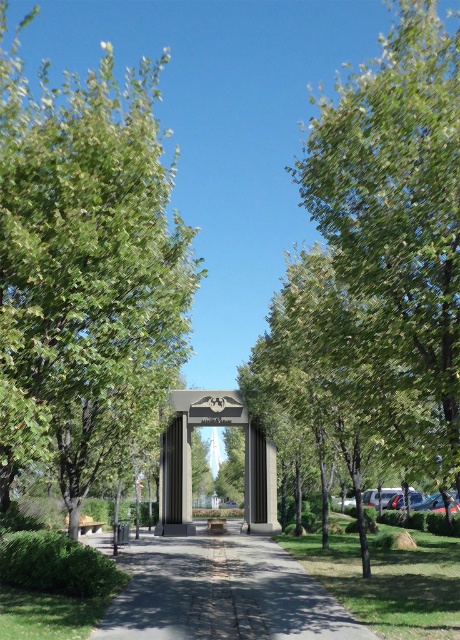
You are a gardener planning to place a 3m wide decorative fountain between the green leafy tree at left and the gray concrete pavement at center. Based on their widths, will the fountain fit without overlapping either object?

The green leafy tree at left might be wider than the gray concrete pavement at center. Since the fountain is 3m wide, it depends on the actual widths. If the combined width of the tree and pavement allows, it could fit, but there is uncertainty due to the comparison in the description.

You are standing at the camera position in the park scene. You want to walk straight ahead to the green leafy tree at center. How far will you have to walk to reach it?

The green leafy tree at center is 7.44 meters away from the camera, so you will have to walk 7.44 meters to reach it.